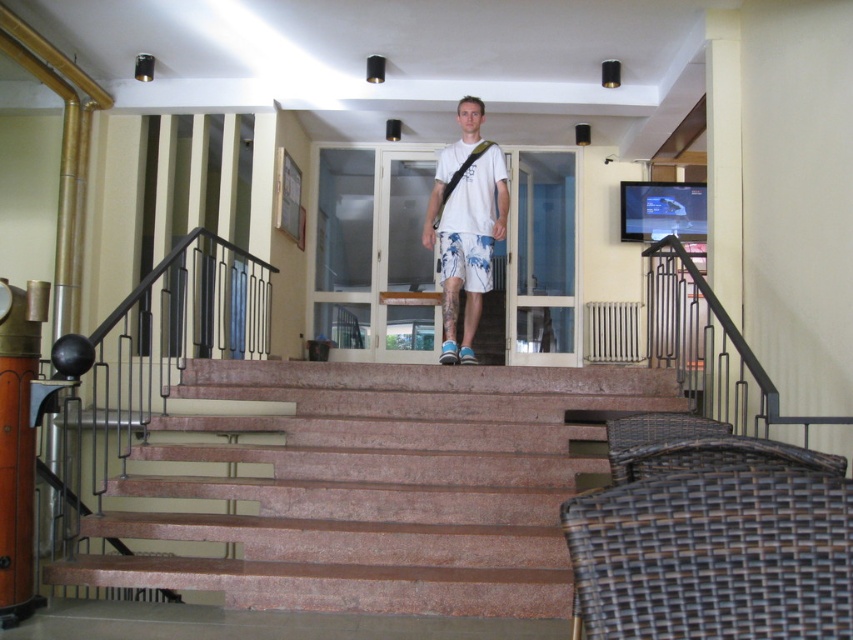
Can you confirm if white cotton t-shirt at center is smaller than white floral shorts at center?

No.

This screenshot has height=640, width=853. What do you see at coordinates (466, 225) in the screenshot?
I see `white cotton t-shirt at center` at bounding box center [466, 225].

You are a GUI agent. You are given a task and a screenshot of the screen. Output one action in this format:
    pyautogui.click(x=<x>, y=<y>)
    Task: Click on the white cotton t-shirt at center
    The height and width of the screenshot is (640, 853).
    Given the screenshot: What is the action you would take?
    pyautogui.click(x=466, y=225)

Locate an element on the screen. Image resolution: width=853 pixels, height=640 pixels. white cotton t-shirt at center is located at coordinates (466, 225).

Is marble stairs at center closer to the viewer compared to white cotton t-shirt at center?

Yes.

Between marble stairs at center and white cotton t-shirt at center, which one has less height?

marble stairs at center

Between point (254, 500) and point (479, 209), which one is positioned behind?

The point (479, 209) is behind.

Image resolution: width=853 pixels, height=640 pixels. Identify the location of marble stairs at center. (363, 484).

How distant is marble stairs at center from white floral shorts at center?

marble stairs at center and white floral shorts at center are 4.41 feet apart.

Does marble stairs at center appear on the left side of white floral shorts at center?

Indeed, marble stairs at center is positioned on the left side of white floral shorts at center.

Locate an element on the screen. The image size is (853, 640). marble stairs at center is located at coordinates [x=363, y=484].